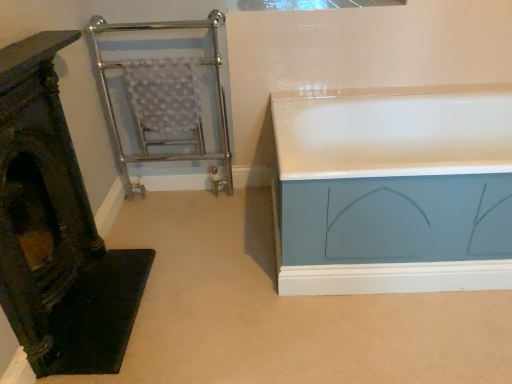
You are a GUI agent. You are given a task and a screenshot of the screen. Output one action in this format:
    pyautogui.click(x=<x>, y=<y>)
    Task: Click on the transparent glass window at upper center
    The height and width of the screenshot is (384, 512).
    Given the screenshot: What is the action you would take?
    pyautogui.click(x=307, y=4)

Which is closer to the camera, (109, 275) or (144, 26)?

The point (109, 275) is closer to the camera.

Which object is further away from the camera taking this photo, wooden carved chair at left or chrome/metal towel rack at left?

Positioned behind is chrome/metal towel rack at left.

From the image's perspective, which one is positioned lower, wooden carved chair at left or chrome/metal towel rack at left?

wooden carved chair at left appears lower in the image.

Would you say white glossy bathtub at right contains wooden carved chair at left?

Actually, wooden carved chair at left is outside white glossy bathtub at right.

From the image's perspective, which one is positioned higher, white glossy bathtub at right or wooden carved chair at left?

white glossy bathtub at right appears higher in the image.

Does white glossy bathtub at right have a lesser height compared to wooden carved chair at left?

Indeed, white glossy bathtub at right has a lesser height compared to wooden carved chair at left.

Between white glossy bathtub at right and wooden carved chair at left, which one has larger width?

white glossy bathtub at right is wider.

The width and height of the screenshot is (512, 384). What are the coordinates of `bathtub below the chrome/metal towel rack at left (from the image's perspective)` in the screenshot? It's located at (393, 189).

Does chrome/metal towel rack at left have a larger size compared to white glossy bathtub at right?

No.

Can we say chrome/metal towel rack at left lies outside white glossy bathtub at right?

That's correct, chrome/metal towel rack at left is outside of white glossy bathtub at right.

Which is behind, point (164, 61) or point (428, 217)?

Positioned behind is point (164, 61).

Does transparent glass window at upper center have a greater height compared to wooden carved chair at left?

No.

Is transparent glass window at upper center situated inside wooden carved chair at left or outside?

transparent glass window at upper center is not enclosed by wooden carved chair at left.

At what (x,y) coordinates should I click in order to perform the action: click on furniture that is in front of the transparent glass window at upper center. Please return your answer as a coordinate pair (x, y). This screenshot has width=512, height=384. Looking at the image, I should click on pos(56,229).

Can you confirm if transparent glass window at upper center is bigger than white glossy bathtub at right?

Incorrect, transparent glass window at upper center is not larger than white glossy bathtub at right.

In terms of width, does transparent glass window at upper center look wider or thinner when compared to white glossy bathtub at right?

Considering their sizes, transparent glass window at upper center looks slimmer than white glossy bathtub at right.

From a real-world perspective, is transparent glass window at upper center above or below white glossy bathtub at right?

Clearly, from a real-world perspective, transparent glass window at upper center is above white glossy bathtub at right.

Is transparent glass window at upper center looking in the opposite direction of white glossy bathtub at right?

No, transparent glass window at upper center is not facing the opposite direction of white glossy bathtub at right.

Does transparent glass window at upper center have a larger size compared to chrome/metal towel rack at left?

No, transparent glass window at upper center is not bigger than chrome/metal towel rack at left.

Does transparent glass window at upper center have a lesser height compared to chrome/metal towel rack at left?

Indeed, transparent glass window at upper center has a lesser height compared to chrome/metal towel rack at left.

From the image's perspective, which is below, transparent glass window at upper center or chrome/metal towel rack at left?

From the image's view, chrome/metal towel rack at left is below.

From the picture: Is chrome/metal towel rack at left next to wooden carved chair at left?

They are not placed beside each other.

Which is more to the left, chrome/metal towel rack at left or wooden carved chair at left?

Positioned to the left is wooden carved chair at left.

From the picture: From a real-world perspective, is chrome/metal towel rack at left over wooden carved chair at left?

Yes.

Who is bigger, chrome/metal towel rack at left or wooden carved chair at left?

chrome/metal towel rack at left.

Find the location of `cage behind the wooden carved chair at left`. cage behind the wooden carved chair at left is located at coordinates (164, 99).

This screenshot has width=512, height=384. Find the location of `bathtub on the right of wooden carved chair at left`. bathtub on the right of wooden carved chair at left is located at coordinates (393, 189).

From the image, which object appears to be farther from white glossy bathtub at right, wooden carved chair at left or chrome/metal towel rack at left?

wooden carved chair at left.

Estimate the real-world distances between objects in this image. Which object is closer to transparent glass window at upper center, chrome/metal towel rack at left or white glossy bathtub at right?

The object closer to transparent glass window at upper center is chrome/metal towel rack at left.

Estimate the real-world distances between objects in this image. Which object is further from chrome/metal towel rack at left, wooden carved chair at left or transparent glass window at upper center?

Among the two, wooden carved chair at left is located further to chrome/metal towel rack at left.

Which object lies further to the anchor point chrome/metal towel rack at left, white glossy bathtub at right or wooden carved chair at left?

The object further to chrome/metal towel rack at left is white glossy bathtub at right.

Which object lies further to the anchor point wooden carved chair at left, transparent glass window at upper center or chrome/metal towel rack at left?

transparent glass window at upper center lies further to wooden carved chair at left than the other object.

Looking at the image, which one is located further to wooden carved chair at left, white glossy bathtub at right or chrome/metal towel rack at left?

white glossy bathtub at right lies further to wooden carved chair at left than the other object.

Considering their positions, is wooden carved chair at left positioned further to white glossy bathtub at right than transparent glass window at upper center?

wooden carved chair at left lies further to white glossy bathtub at right than the other object.

From the image, which object appears to be farther from chrome/metal towel rack at left, transparent glass window at upper center or wooden carved chair at left?

wooden carved chair at left is further to chrome/metal towel rack at left.

I want to click on window between wooden carved chair at left and white glossy bathtub at right, so click(307, 4).

Locate an element on the screen. This screenshot has height=384, width=512. cage located between wooden carved chair at left and white glossy bathtub at right in the left-right direction is located at coordinates (164, 99).

Identify the location of cage positioned between wooden carved chair at left and transparent glass window at upper center from near to far. (164, 99).

Locate an element on the screen. The height and width of the screenshot is (384, 512). window between chrome/metal towel rack at left and white glossy bathtub at right is located at coordinates (307, 4).